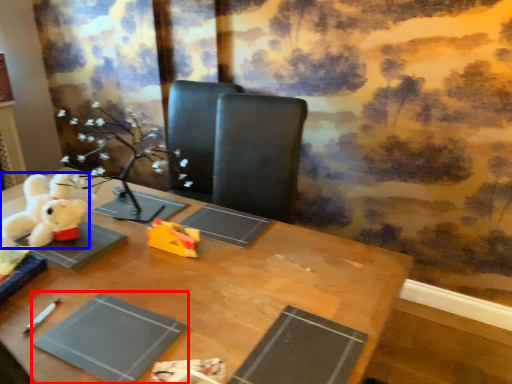
Question: Among these objects, which one is farthest to the camera, paperback book (highlighted by a red box) or toy (highlighted by a blue box)?

Choices:
 (A) paperback book
 (B) toy

Answer: (B)